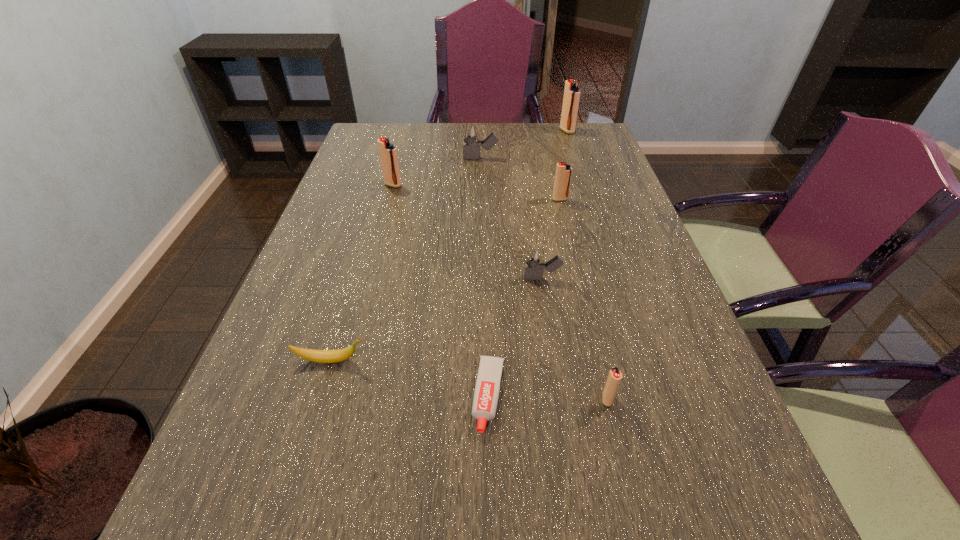
Select which object appears as the sixth closest to the toothpaste. Please provide its 2D coordinates. Your answer should be formatted as a tuple, i.e. [(x, y)], where the tuple contains the x and y coordinates of a point satisfying the conditions above.

[(471, 132)]

Where is `object identified as the fifth closest to the tallest object`? The height and width of the screenshot is (540, 960). object identified as the fifth closest to the tallest object is located at coordinates (487, 388).

Identify which igniter is the nearest to the nearer gray igniter. Please provide its 2D coordinates. Your answer should be formatted as a tuple, i.e. [(x, y)], where the tuple contains the x and y coordinates of a point satisfying the conditions above.

[(614, 377)]

Image resolution: width=960 pixels, height=540 pixels. Find the location of `the fourth closest igniter to the fifth igniter from right to left`. the fourth closest igniter to the fifth igniter from right to left is located at coordinates (535, 258).

Identify which red igniter is the third closest to the yellow banana. Please provide its 2D coordinates. Your answer should be formatted as a tuple, i.e. [(x, y)], where the tuple contains the x and y coordinates of a point satisfying the conditions above.

[(563, 171)]

Select which red igniter appears as the third closest to the biggest red igniter. Please provide its 2D coordinates. Your answer should be formatted as a tuple, i.e. [(x, y)], where the tuple contains the x and y coordinates of a point satisfying the conditions above.

[(614, 377)]

At what (x,y) coordinates should I click in order to perform the action: click on vacant area that satisfies the following two spatial constraints: 1. on the back side of the farthest red igniter; 2. on the left side of the fourth farthest igniter. Please return your answer as a coordinate pair (x, y). The height and width of the screenshot is (540, 960). Looking at the image, I should click on (543, 131).

Find the location of a particular element. free space that satisfies the following two spatial constraints: 1. on the front side of the farthest red igniter; 2. at the stem of the banana is located at coordinates (642, 361).